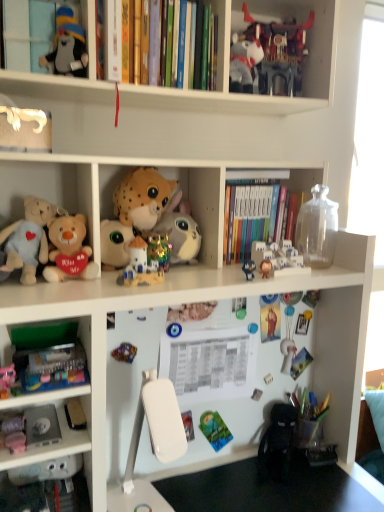
Question: From a real-world perspective, does white plastic table at lower center stand above hardcover books at center, arranged as the 1th book when viewed from the back?

Choices:
 (A) no
 (B) yes

Answer: (A)

Question: Is white plastic table at lower center at the left side of hardcover books at center, marked as the second book in a front-to-back arrangement?

Choices:
 (A) no
 (B) yes

Answer: (B)

Question: Is white plastic table at lower center aimed at hardcover books at center, placed as the 2th book when sorted from left to right?

Choices:
 (A) no
 (B) yes

Answer: (A)

Question: Considering the relative sizes of white plastic table at lower center and hardcover books at center, which is the 1th book from right to left, in the image provided, is white plastic table at lower center taller than hardcover books at center, which is the 1th book from right to left,?

Choices:
 (A) no
 (B) yes

Answer: (A)

Question: Is white plastic table at lower center wider than hardcover books at center, the 2th book in the top-to-bottom sequence?

Choices:
 (A) no
 (B) yes

Answer: (B)

Question: From a real-world perspective, is white plastic castle at upper center, which ranks as the fifth toy in top-to-bottom order, above or below shiny plastic robot at upper center, the ninth toy positioned from the bottom?

Choices:
 (A) above
 (B) below

Answer: (B)

Question: Choose the correct answer: Is white plastic castle at upper center, which ranks as the fifth toy in top-to-bottom order, inside shiny plastic robot at upper center, which appears as the 1th toy when viewed from the top, or outside it?

Choices:
 (A) inside
 (B) outside

Answer: (B)

Question: Looking at the image, does white plastic castle at upper center, marked as the fifth toy in a bottom-to-top arrangement, seem bigger or smaller compared to shiny plastic robot at upper center, the ninth toy positioned from the bottom?

Choices:
 (A) small
 (B) big

Answer: (A)

Question: From the image's perspective, is white plastic castle at upper center, which ranks as the fifth toy in top-to-bottom order, above or below shiny plastic robot at upper center, the ninth toy positioned from the bottom?

Choices:
 (A) below
 (B) above

Answer: (A)

Question: Considering their positions, is hardcover books at upper center, the 1th book when ordered from front to back, located in front of or behind matte blue plush at upper center, the 2th toy positioned from the bottom?

Choices:
 (A) behind
 (B) front

Answer: (B)

Question: In terms of width, does hardcover books at upper center, marked as the 2th book in a back-to-front arrangement, look wider or thinner when compared to matte blue plush at upper center, the eighth toy from the top?

Choices:
 (A) wide
 (B) thin

Answer: (A)

Question: Looking at the image, does hardcover books at upper center, marked as the 2th book in a back-to-front arrangement, seem bigger or smaller compared to matte blue plush at upper center, the eighth toy from the top?

Choices:
 (A) small
 (B) big

Answer: (B)

Question: Is hardcover books at upper center, the 1th book positioned from the top, taller or shorter than matte blue plush at upper center, the eighth toy from the top?

Choices:
 (A) short
 (B) tall

Answer: (B)

Question: Considering the relative positions of metallic multicolored toy at center, the 7th toy when ordered from top to bottom, and matte black plush toy at upper left, arranged as the eighth toy when ordered from the bottom, in the image provided, is metallic multicolored toy at center, the 7th toy when ordered from top to bottom, to the left or to the right of matte black plush toy at upper left, arranged as the eighth toy when ordered from the bottom,?

Choices:
 (A) right
 (B) left

Answer: (A)

Question: Looking at their shapes, would you say metallic multicolored toy at center, the 7th toy when ordered from top to bottom, is wider or thinner than matte black plush toy at upper left, arranged as the eighth toy when ordered from the bottom?

Choices:
 (A) wide
 (B) thin

Answer: (B)